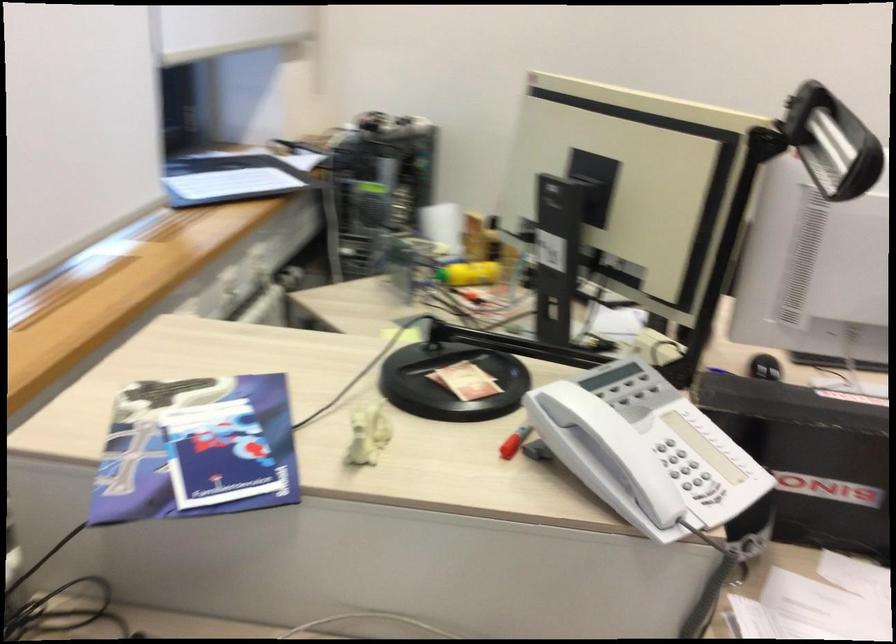
I want to click on red marker, so click(x=513, y=442).